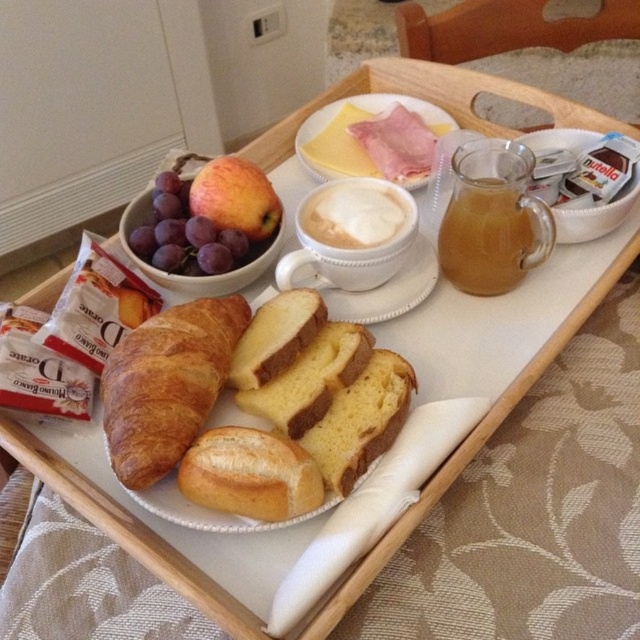
Question: Which of the following is the closest to the observer?

Choices:
 (A) (204, 488)
 (B) (492, 211)

Answer: (A)

Question: Can you confirm if golden crusty bread at center is positioned below yellow cheese at center?

Choices:
 (A) yes
 (B) no

Answer: (A)

Question: Can you confirm if translucent glass pitcher at center-right is positioned to the left of shiny purple grapes at upper left?

Choices:
 (A) no
 (B) yes

Answer: (A)

Question: Is golden crusty bread at center above yellow sponge cake at center?

Choices:
 (A) no
 (B) yes

Answer: (A)

Question: Which of these objects is positioned farthest from the golden brown croissant at left?

Choices:
 (A) translucent glass pitcher at center-right
 (B) yellow sponge cake at center

Answer: (A)

Question: Which point is closer to the camera?

Choices:
 (A) [444, 228]
 (B) [380, 410]
 (C) [337, 150]
 (D) [278, 221]

Answer: (B)